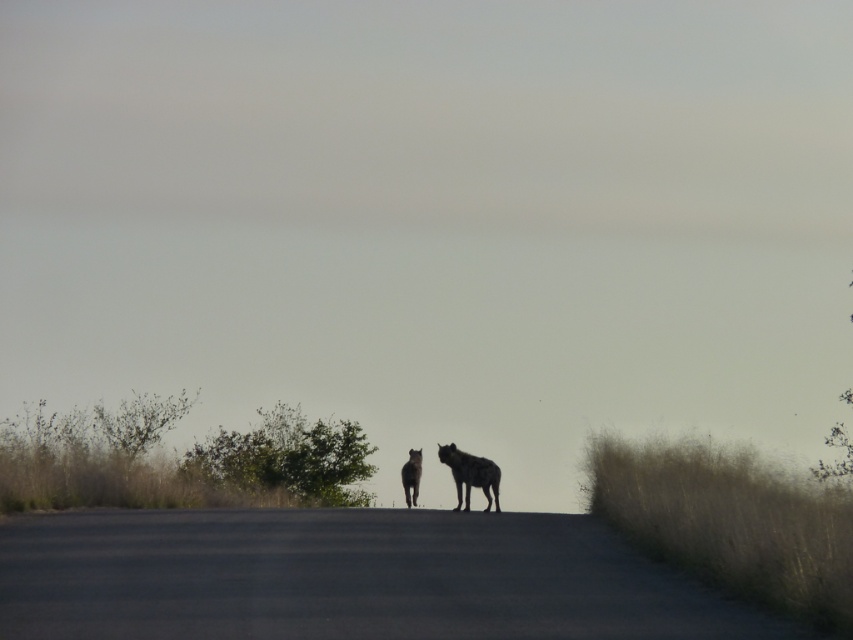
You are standing on the paved road in the scene and see the point marked at coordinates (469, 474). What object is located at that point?

The point at (469, 474) is on a spotted fur hyena at center.

You are a wildlife photographer who wants to capture both the spotted fur hyena at center and the black fur hyena at center in a single frame. Based on their positions, which hyena should you adjust your camera focus to first to ensure both are in the frame?

The spotted fur hyena at center is to the right of the black fur hyena at center, so you should focus on the black fur hyena at center first to ensure both are within the frame.